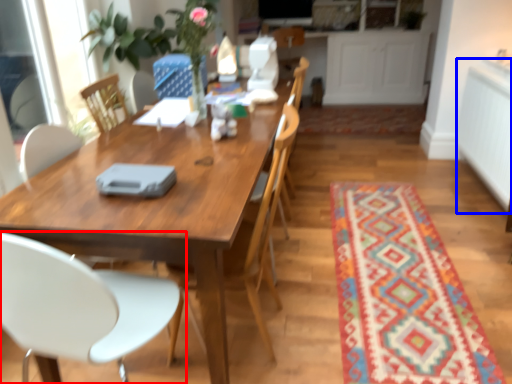
Question: Which point is further to the camera, chair (highlighted by a red box) or counter top (highlighted by a blue box)?

Choices:
 (A) chair
 (B) counter top

Answer: (B)